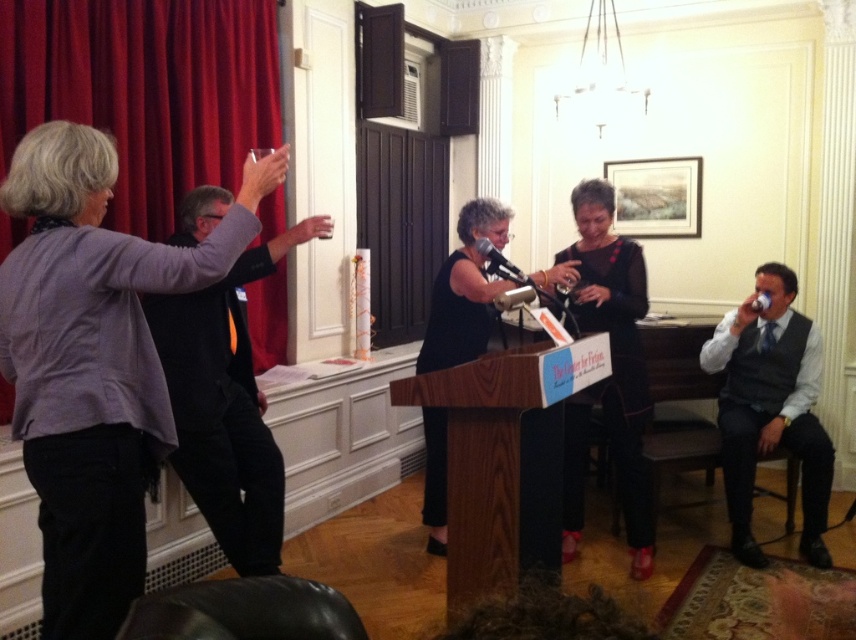
Between point (170, 65) and point (632, 544), which one is positioned in front?

Positioned in front is point (170, 65).

Is red velvet curtain at left to the left of black velvet dress at center from the viewer's perspective?

Indeed, red velvet curtain at left is positioned on the left side of black velvet dress at center.

In the scene shown: Who is more distant from viewer, (138, 173) or (651, 540)?

Point (651, 540)

At what (x,y) coordinates should I click in order to perform the action: click on red velvet curtain at left. Please return your answer as a coordinate pair (x, y). Looking at the image, I should click on (146, 90).

Is point (782, 372) farther from camera compared to point (509, 268)?

Yes, point (782, 372) is behind point (509, 268).

Who is shorter, gray wool vest at right or black matte microphone at center?

A: black matte microphone at center

Between point (733, 515) and point (486, 246), which one is positioned in front?

Positioned in front is point (486, 246).

You are a GUI agent. You are given a task and a screenshot of the screen. Output one action in this format:
    pyautogui.click(x=<x>, y=<y>)
    Task: Click on the gray wool vest at right
    
    Given the screenshot: What is the action you would take?
    pyautogui.click(x=770, y=410)

Between point (575, 532) and point (486, 256), which one is positioned behind?

Positioned behind is point (575, 532).

Between black velvet dress at center and black matte microphone at center, which one is positioned lower?

black velvet dress at center

Where is `black velvet dress at center`? black velvet dress at center is located at coordinates (611, 371).

This screenshot has height=640, width=856. I want to click on black velvet dress at center, so click(x=611, y=371).